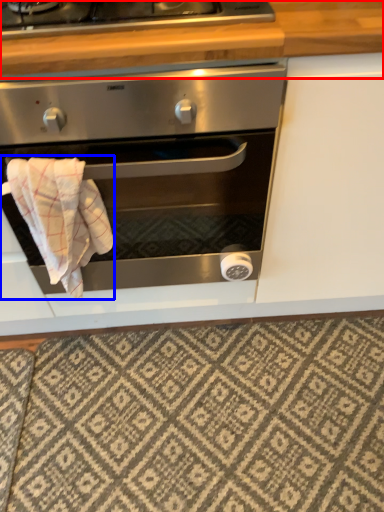
Question: Which object appears closest to the camera in this image, counter top (highlighted by a red box) or bath towel (highlighted by a blue box)?

Choices:
 (A) counter top
 (B) bath towel

Answer: (A)